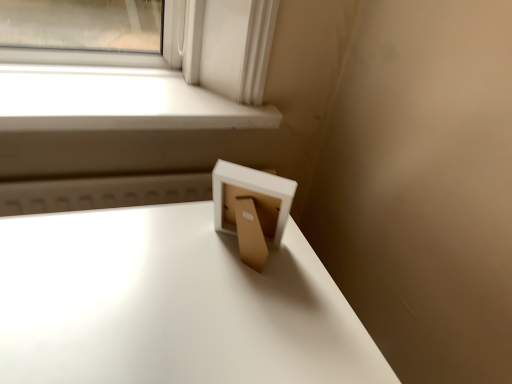
Where is `white glossy table at center`? This screenshot has height=384, width=512. white glossy table at center is located at coordinates (170, 304).

Image resolution: width=512 pixels, height=384 pixels. What do you see at coordinates (170, 304) in the screenshot? I see `white glossy table at center` at bounding box center [170, 304].

What do you see at coordinates (151, 78) in the screenshot? Image resolution: width=512 pixels, height=384 pixels. I see `white matte window sill at upper left` at bounding box center [151, 78].

Image resolution: width=512 pixels, height=384 pixels. Identify the location of white matte window sill at upper left. (151, 78).

This screenshot has height=384, width=512. I want to click on white glossy table at center, so click(170, 304).

Can you confirm if white glossy table at center is positioned to the left of white matte window sill at upper left?

Incorrect, white glossy table at center is not on the left side of white matte window sill at upper left.

Consider the image. Considering their positions, is white glossy table at center located in front of or behind white matte window sill at upper left?

white glossy table at center is positioned closer to the viewer than white matte window sill at upper left.

Which is farther, [119,380] or [18,68]?

Point [18,68]

From the image's perspective, which one is positioned higher, white glossy table at center or white matte window sill at upper left?

white matte window sill at upper left is shown above in the image.

From a real-world perspective, is white glossy table at center positioned under white matte window sill at upper left based on gravity?

Yes, from a real-world perspective, white glossy table at center is under white matte window sill at upper left.

Between white glossy table at center and white matte window sill at upper left, which one has larger width?

white glossy table at center.

Does white glossy table at center have a greater height compared to white matte window sill at upper left?

Yes, white glossy table at center is taller than white matte window sill at upper left.

Between white glossy table at center and white matte window sill at upper left, which one has smaller size?

white matte window sill at upper left.

Is white glossy table at center situated inside white matte window sill at upper left or outside?

white glossy table at center is spatially situated outside white matte window sill at upper left.

Is the surface of white glossy table at center in direct contact with white matte window sill at upper left?

white glossy table at center and white matte window sill at upper left are not in contact.

Is white glossy table at center positioned with its back to white matte window sill at upper left?

Yes, white glossy table at center's orientation is away from white matte window sill at upper left.

How many degrees apart are the facing directions of white glossy table at center and white matte window sill at upper left?

The angle between the facing direction of white glossy table at center and the facing direction of white matte window sill at upper left is 0.354 degrees.

The height and width of the screenshot is (384, 512). Identify the location of table in front of the white matte window sill at upper left. (170, 304).

Visually, is white matte window sill at upper left positioned to the left or to the right of white glossy table at center?

Based on their positions, white matte window sill at upper left is located to the left of white glossy table at center.

Is the depth of white matte window sill at upper left less than that of white glossy table at center?

No, white matte window sill at upper left is behind white glossy table at center.

Does point (238, 36) come in front of point (305, 340)?

No, it is not.

From the image's perspective, between white matte window sill at upper left and white glossy table at center, who is located below?

white glossy table at center, from the image's perspective.

From a real-world perspective, who is located higher, white matte window sill at upper left or white glossy table at center?

white matte window sill at upper left is physically above.

Considering the relative sizes of white matte window sill at upper left and white glossy table at center in the image provided, is white matte window sill at upper left thinner than white glossy table at center?

Indeed, white matte window sill at upper left has a lesser width compared to white glossy table at center.

From their relative heights in the image, would you say white matte window sill at upper left is taller or shorter than white glossy table at center?

Clearly, white matte window sill at upper left is shorter compared to white glossy table at center.

Considering the sizes of white matte window sill at upper left and white glossy table at center in the image, is white matte window sill at upper left bigger or smaller than white glossy table at center?

white matte window sill at upper left is smaller than white glossy table at center.

Would you say white glossy table at center is part of white matte window sill at upper left's contents?

No, white glossy table at center is not inside white matte window sill at upper left.

Is there a large distance between white matte window sill at upper left and white glossy table at center?

They are positioned close to each other.

Looking at this image, is white matte window sill at upper left looking in the opposite direction of white glossy table at center?

That's not correct — white matte window sill at upper left is not looking away from white glossy table at center.

Consider the image. Can you tell me how much white matte window sill at upper left and white glossy table at center differ in facing direction?

They differ by 0.354 degrees in their facing directions.

Image resolution: width=512 pixels, height=384 pixels. I want to click on window above the white glossy table at center (from a real-world perspective), so click(151, 78).

Locate an element on the screen. The image size is (512, 384). window on the left of white glossy table at center is located at coordinates (151, 78).

You are a GUI agent. You are given a task and a screenshot of the screen. Output one action in this format:
    pyautogui.click(x=<x>, y=<y>)
    Task: Click on the window above the white glossy table at center (from a real-world perspective)
    This screenshot has width=512, height=384.
    Given the screenshot: What is the action you would take?
    pyautogui.click(x=151, y=78)